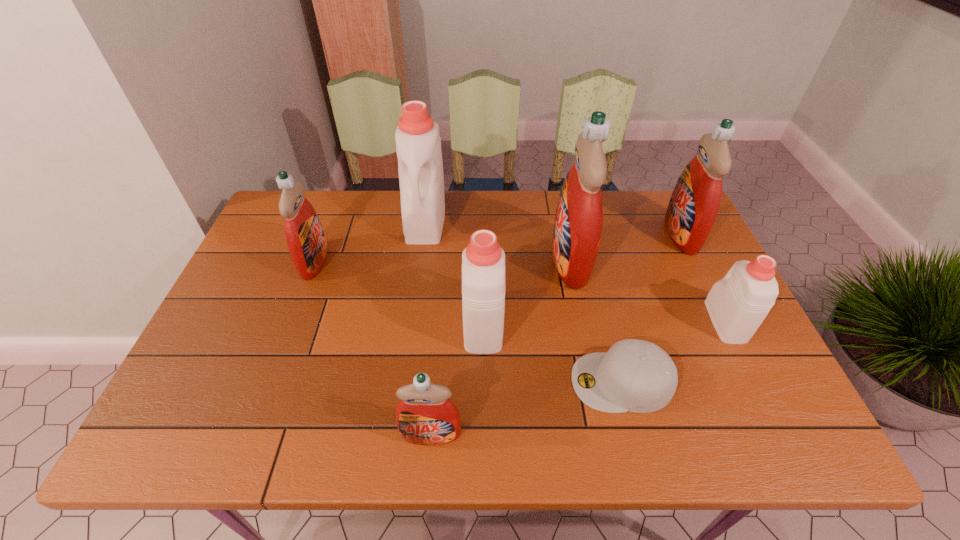
I want to click on detergent that is at the near edge, so click(x=425, y=415).

This screenshot has width=960, height=540. I want to click on cap present at the near edge, so click(638, 376).

The width and height of the screenshot is (960, 540). I want to click on object that is at the left edge, so click(306, 242).

Identify the location of object that is at the far right corner. (694, 204).

In the image, there is a desktop. At what (x,y) coordinates should I click in order to perform the action: click on vacant space at the far edge. Please return your answer as a coordinate pair (x, y). The height and width of the screenshot is (540, 960). Looking at the image, I should click on (456, 212).

The width and height of the screenshot is (960, 540). I want to click on free region at the near edge of the desktop, so click(490, 450).

Locate an element on the screen. This screenshot has height=540, width=960. vacant space at the right edge of the desktop is located at coordinates (745, 354).

Where is `vacant area at the far right corner of the desktop`? vacant area at the far right corner of the desktop is located at coordinates (660, 201).

This screenshot has height=540, width=960. I want to click on free space between the second smallest white detergent and the second red detergent from left to right, so click(457, 379).

The image size is (960, 540). Identify the location of empty space between the second red detergent from left to right and the gray cap. (526, 408).